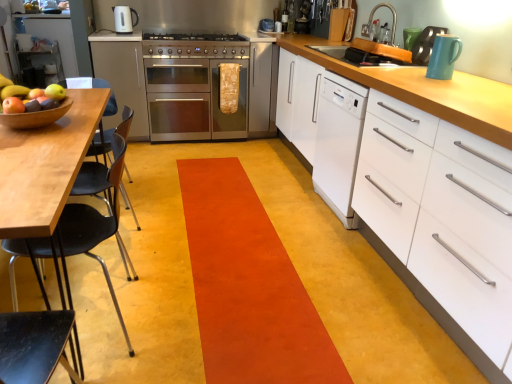
Where is `free space in front of teal ceramic mug at upper right, the 2th kitchen appliance from the left`? This screenshot has width=512, height=384. free space in front of teal ceramic mug at upper right, the 2th kitchen appliance from the left is located at coordinates (453, 76).